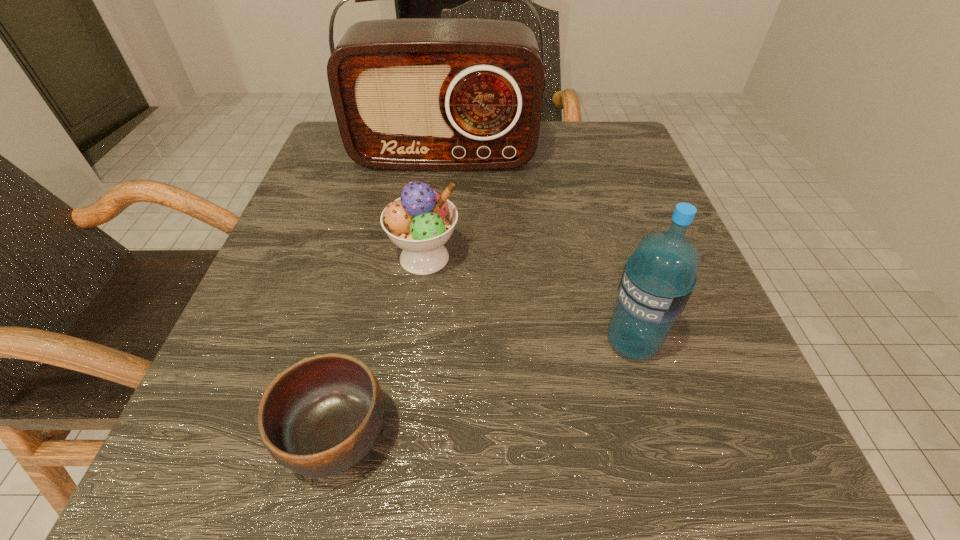
The image size is (960, 540). I want to click on free space between the third shortest object and the second shortest object, so click(x=528, y=300).

The image size is (960, 540). In order to click on free spot between the shortest object and the second tallest object in this screenshot , I will do 484,390.

Image resolution: width=960 pixels, height=540 pixels. In order to click on vacant space that's between the second nearest object and the third nearest object in this screenshot , I will do `click(528, 300)`.

Image resolution: width=960 pixels, height=540 pixels. Find the location of `blank region between the third farthest object and the second shortest object`. blank region between the third farthest object and the second shortest object is located at coordinates (528, 300).

The image size is (960, 540). In order to click on free area in between the shortest object and the second tallest object in this screenshot , I will do `click(484, 390)`.

Point out which object is positioned as the third nearest to the water bottle. Please provide its 2D coordinates. Your answer should be formatted as a tuple, i.e. [(x, y)], where the tuple contains the x and y coordinates of a point satisfying the conditions above.

[(420, 94)]

Identify which object is located as the third nearest to the nearest object. Please provide its 2D coordinates. Your answer should be formatted as a tuple, i.e. [(x, y)], where the tuple contains the x and y coordinates of a point satisfying the conditions above.

[(420, 94)]

You are a GUI agent. You are given a task and a screenshot of the screen. Output one action in this format:
    pyautogui.click(x=<x>, y=<y>)
    Task: Click on the free space in the image that satisfies the following two spatial constraints: 1. on the front side of the second shortest object; 2. on the right side of the water bottle
    
    Given the screenshot: What is the action you would take?
    pyautogui.click(x=414, y=343)

Where is `free space in the image that satisfies the following two spatial constraints: 1. on the back side of the nearest object; 2. on the right side of the water bottle`? free space in the image that satisfies the following two spatial constraints: 1. on the back side of the nearest object; 2. on the right side of the water bottle is located at coordinates (358, 343).